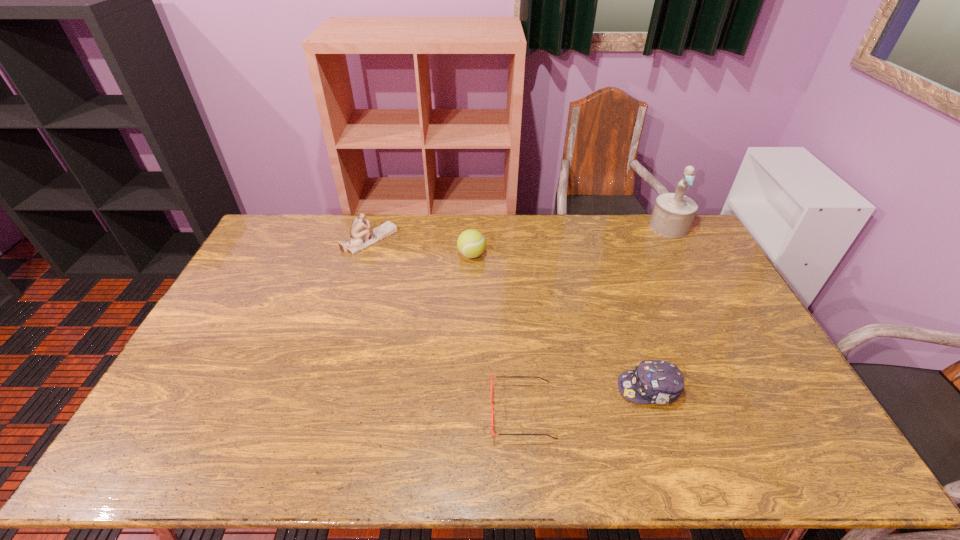
I want to click on object located at the near edge, so click(492, 408).

Where is `object at the right edge`? The height and width of the screenshot is (540, 960). object at the right edge is located at coordinates (673, 213).

The width and height of the screenshot is (960, 540). What are the coordinates of `object at the far right corner` in the screenshot? It's located at (673, 213).

In the image, there is a desktop. Where is `vacant space at the far edge`? This screenshot has height=540, width=960. vacant space at the far edge is located at coordinates (649, 246).

Locate an element on the screen. vacant space at the near edge of the desktop is located at coordinates (343, 468).

At what (x,y) coordinates should I click in order to perform the action: click on free region at the left edge of the desktop. Please return your answer as a coordinate pair (x, y). This screenshot has height=540, width=960. Looking at the image, I should click on (181, 373).

Find the location of a particular element. vacant space at the right edge of the desktop is located at coordinates (751, 324).

This screenshot has width=960, height=540. In order to click on free space at the far left corner of the desktop in this screenshot , I will do `click(284, 224)`.

Find the location of `free space at the near left corner`. free space at the near left corner is located at coordinates (141, 439).

Locate an element on the screen. Image resolution: width=960 pixels, height=540 pixels. vacant space at the far right corner is located at coordinates (693, 245).